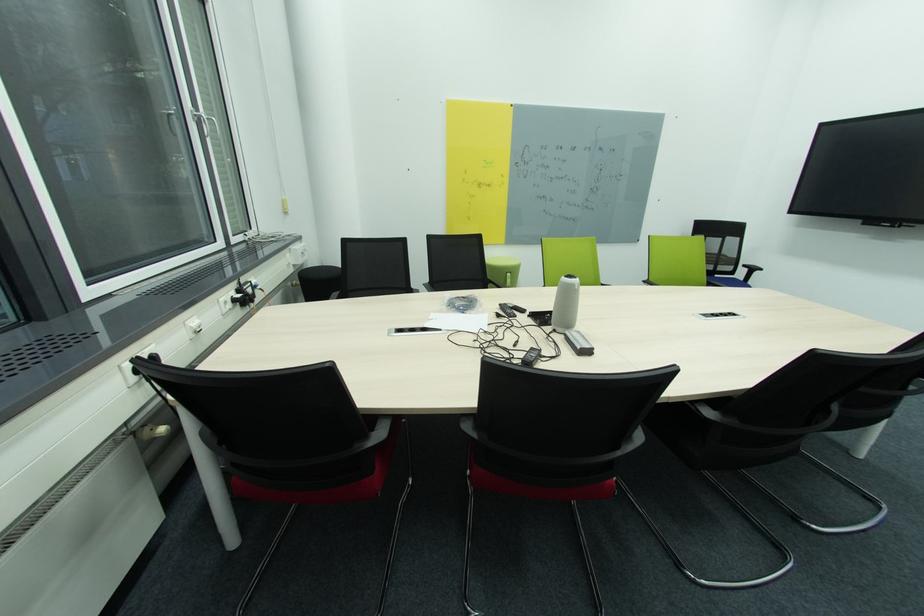
At what (x,y) coordinates should I click in order to perform the action: click on green stool surface. Please return your answer as a coordinate pair (x, y). The image size is (924, 616). Looking at the image, I should click on pos(748,274).